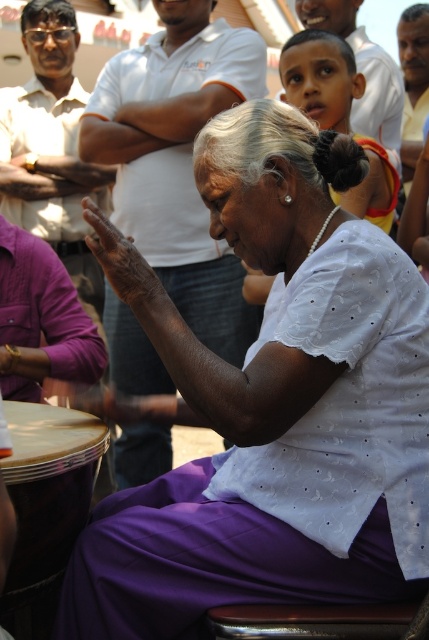
Is purple satin saree at center shorter than white dotted blouse at center?

No, purple satin saree at center is not shorter than white dotted blouse at center.

Can you confirm if purple satin saree at center is positioned below white dotted blouse at center?

Indeed, purple satin saree at center is positioned under white dotted blouse at center.

Is point (283, 502) positioned in front of point (296, 77)?

Yes.

Find the location of a particular element. purple satin saree at center is located at coordinates (272, 404).

Who is higher up, purple satin saree at center or purple leather drum at lower left?

purple satin saree at center is above.

Between purple satin saree at center and purple leather drum at lower left, which one is positioned lower?

purple leather drum at lower left is lower down.

The width and height of the screenshot is (429, 640). Describe the element at coordinates (272, 404) in the screenshot. I see `purple satin saree at center` at that location.

The height and width of the screenshot is (640, 429). I want to click on purple satin saree at center, so click(272, 404).

Does point (51, 481) lie behind point (305, 60)?

No, it is in front of (305, 60).

Does purple leather drum at lower left have a greater height compared to white dotted blouse at center?

Incorrect, purple leather drum at lower left's height is not larger of white dotted blouse at center's.

Identify the location of purple leather drum at lower left. Image resolution: width=429 pixels, height=640 pixels. (45, 506).

The width and height of the screenshot is (429, 640). I want to click on purple leather drum at lower left, so click(45, 506).